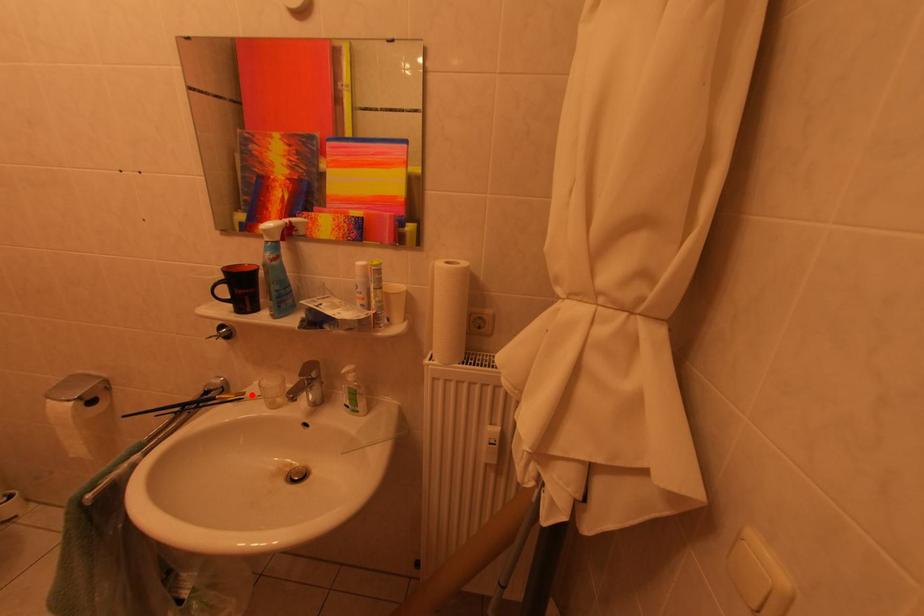
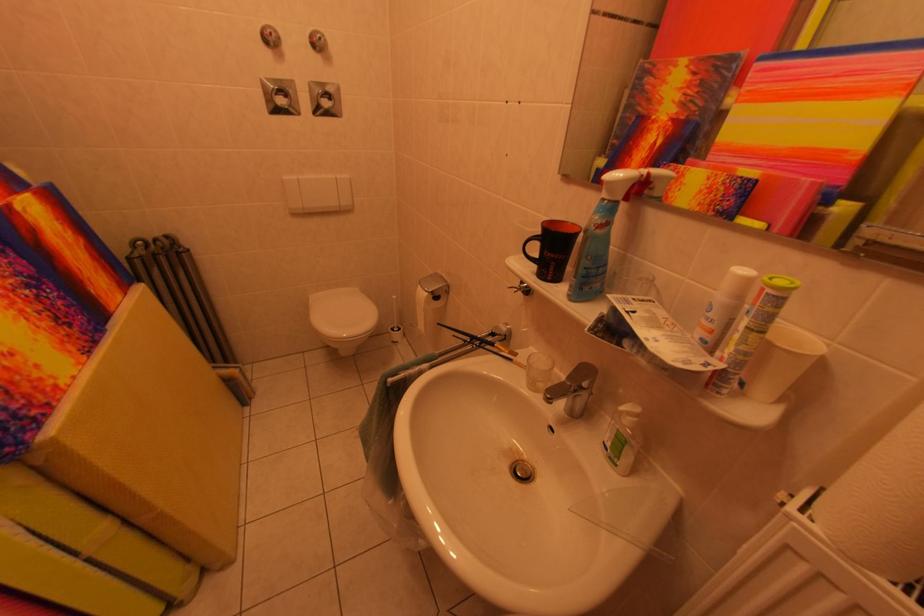
Question: I am providing you with two images of the same scene from different viewpoints. A red point is shown in image1. For the corresponding object point in image2, is it positioned nearer or farther from the camera?

Choices:
 (A) Nearer
 (B) Farther

Answer: (A)